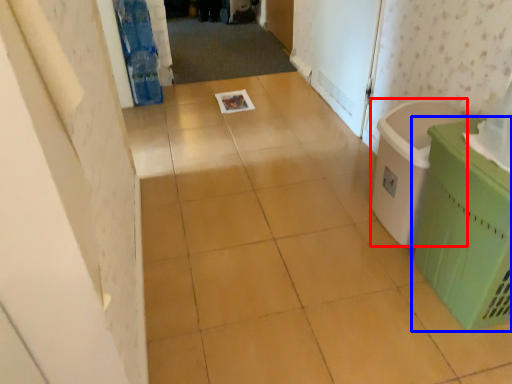
Question: Among these objects, which one is nearest to the camera, laundry basket (highlighted by a red box) or waste container (highlighted by a blue box)?

Choices:
 (A) laundry basket
 (B) waste container

Answer: (B)